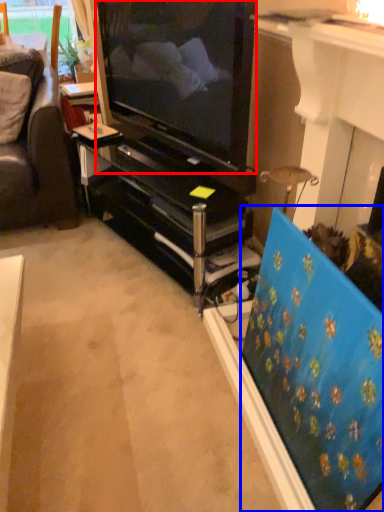
Question: Which point is closer to the camera, television (highlighted by a red box) or flat (highlighted by a blue box)?

Choices:
 (A) television
 (B) flat

Answer: (B)